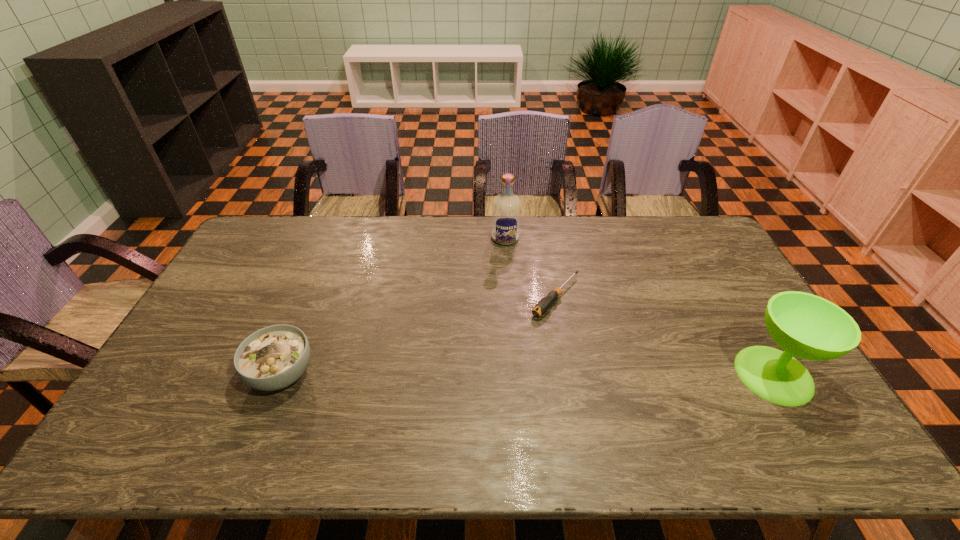
Find the location of a particular element. The image size is (960, 540). blank space located 0.350m on the label of the tallest object is located at coordinates (508, 318).

Find the location of a particular element. This screenshot has height=540, width=960. vacant space located on the label of the tallest object is located at coordinates (507, 280).

This screenshot has width=960, height=540. I want to click on vacant space located 0.140m on the label of the tallest object, so click(507, 272).

I want to click on free region located at the tip of the screwdriver, so click(x=459, y=399).

Image resolution: width=960 pixels, height=540 pixels. I want to click on vacant space located 0.140m at the tip of the screwdriver, so click(x=515, y=342).

Locate an element on the screen. blank area located 0.270m at the tip of the screwdriver is located at coordinates (486, 372).

Identify the location of object situated at the far edge. Image resolution: width=960 pixels, height=540 pixels. (506, 208).

Identify the location of soup bowl located at the near edge. This screenshot has width=960, height=540. (272, 358).

Locate an element on the screen. wineglass that is at the near edge is located at coordinates (804, 325).

I want to click on object located in the right edge section of the desktop, so click(804, 325).